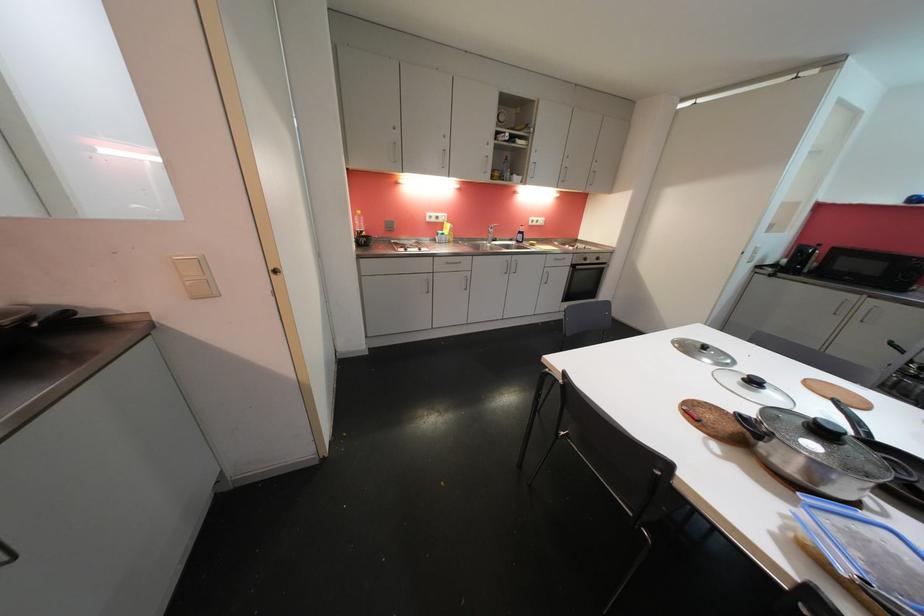
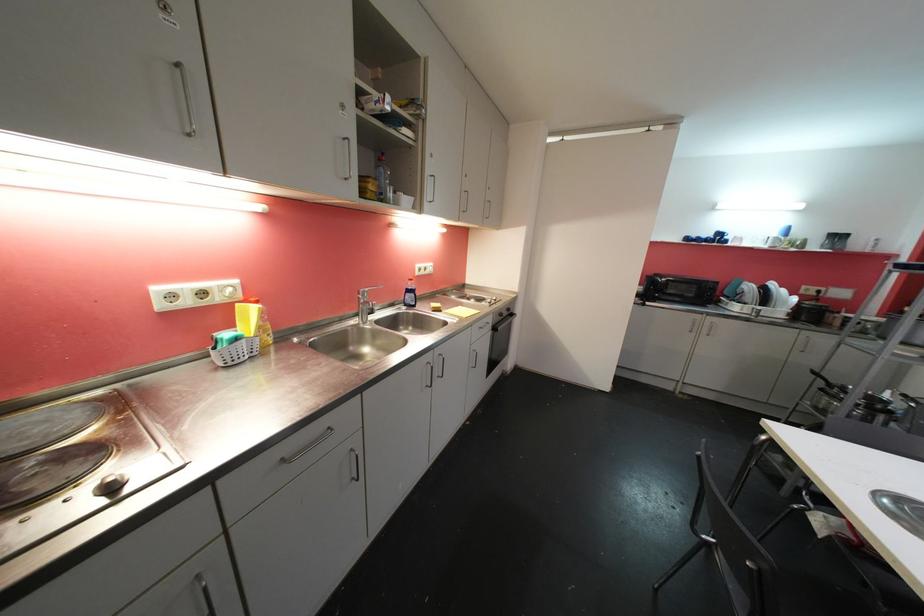
The point at [424,252] is marked in the first image. Where is the corresponding point in the second image?

(116, 490)